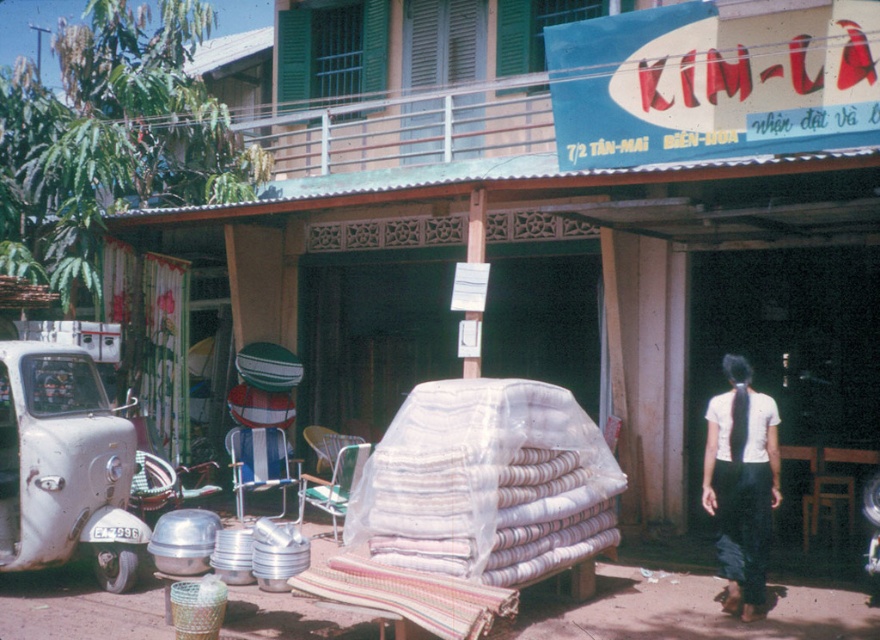
Question: Which is nearer to the white woven blanket at center?

Choices:
 (A) white cotton shirt at center
 (B) white matte car at left

Answer: (A)

Question: Is the position of white woven blanket at center more distant than that of white cotton shirt at center?

Choices:
 (A) no
 (B) yes

Answer: (A)

Question: Observing the image, what is the correct spatial positioning of white matte car at left in reference to white cotton shirt at center?

Choices:
 (A) left
 (B) right

Answer: (A)

Question: Which of the following is the farthest from the observer?

Choices:
 (A) (526, 515)
 (B) (735, 358)

Answer: (B)

Question: Can you confirm if white matte car at left is positioned to the left of white cotton shirt at center?

Choices:
 (A) no
 (B) yes

Answer: (B)

Question: Which is nearer to the white woven blanket at center?

Choices:
 (A) white matte car at left
 (B) white cotton shirt at center

Answer: (B)